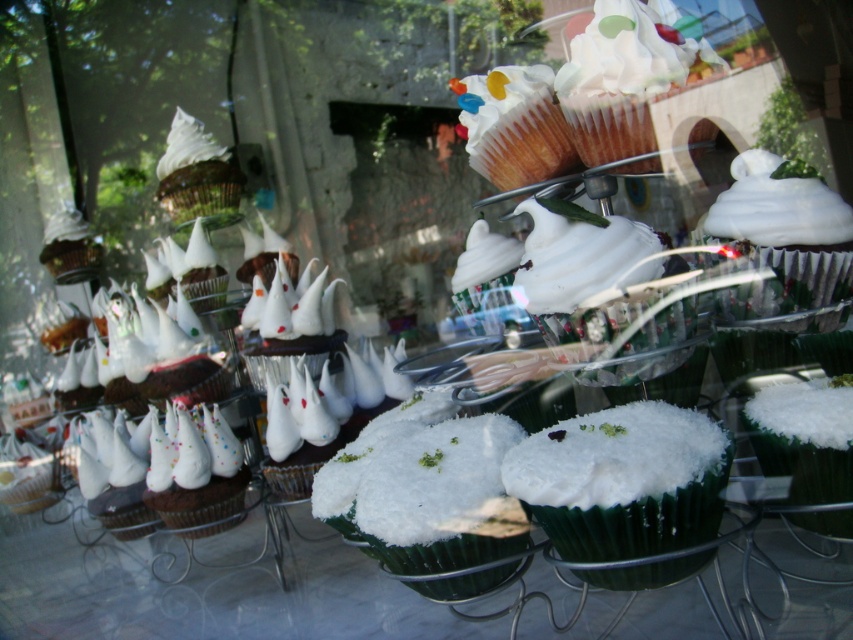
You are a customer standing in front of the bakery window. You want to buy the cupcake at point (519, 467). The bakery has a policy that you can only purchase cupcakes that are at least 25 inches away from the window. Can you buy this cupcake?

The cupcake at point (519, 467) is 30.59 inches away from the window, which meets the bakery policy requirement of at least 25 inches. Therefore, you can buy this cupcake.

You are a customer at the bakery window. You notice two types of cupcake frostings displayed. The first is the white fluffy frosting at center, and the second is the white glossy frosting at upper left. Which frosting takes up more space in its respective cupcake?

The white glossy frosting at upper left occupies more space than the white fluffy frosting at center.

You are a customer at the bakery and want to choose a cupcake with the most voluminous frosting. Based on the cupcakes displayed in the bakery window, which one has the larger frosting volume between the white fluffy frosting at center and the white glossy frosting at center?

The white fluffy frosting at center has a larger size compared to the white glossy frosting at center, so the white fluffy frosting at center has the larger frosting volume.